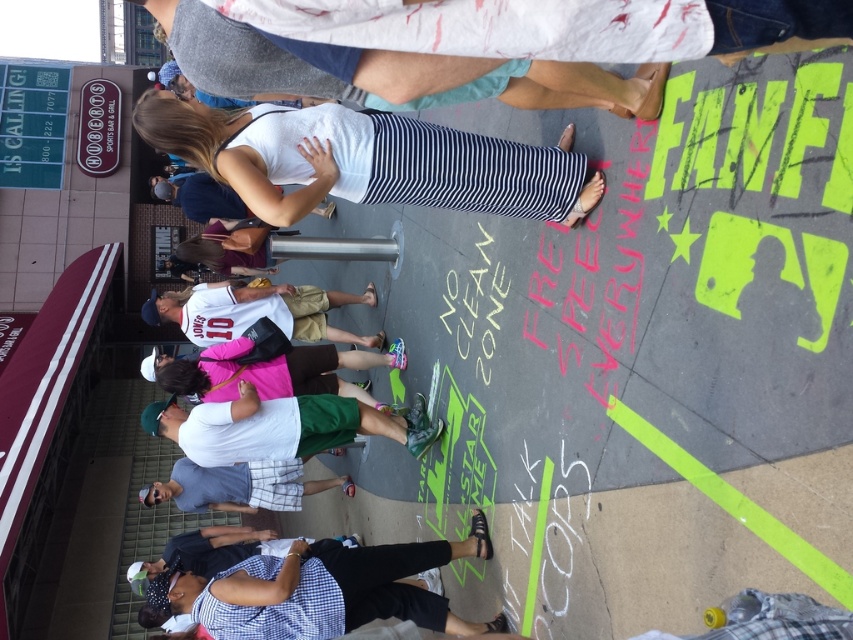
You are standing at the point labeled as point (201, 324) and want to walk towards the point labeled as point (482, 556). Considering the birdseye view of the scene, which direction should you move to get closer to your destination?

Since point (482, 556) is closer to the viewer than point (201, 324), you should move forward towards the direction of the viewer to reach your destination.

You are a photographer trying to capture the protest scene. You notice the checkered fabric shirt at lower center and the white jersey at center. Which clothing item is closer to the camera?

The checkered fabric shirt at lower center is positioned under the white jersey at center, so it is closer to the camera.